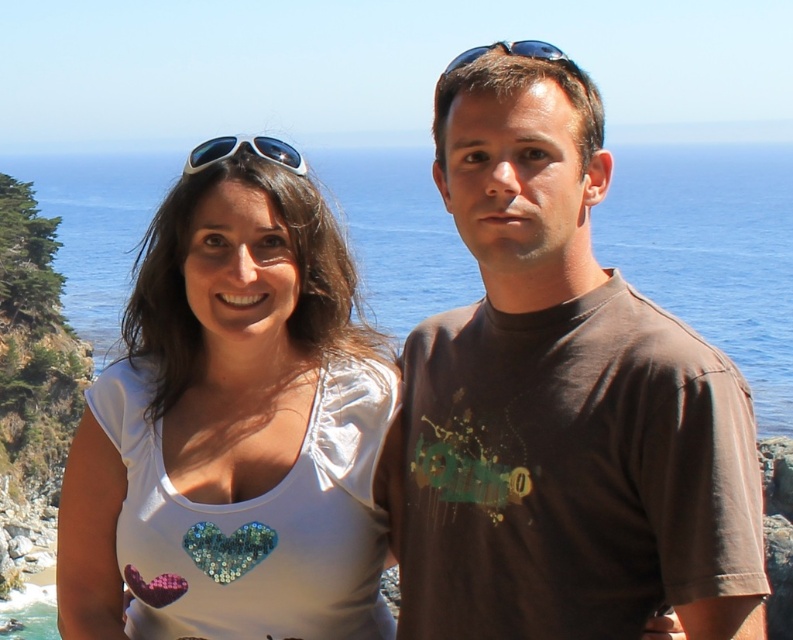
Question: Is blue water at center wider than white plastic goggles at upper center?

Choices:
 (A) no
 (B) yes

Answer: (B)

Question: Is brown cotton t-shirt at right smaller than white plastic goggles at upper center?

Choices:
 (A) no
 (B) yes

Answer: (B)

Question: Which point is farther to the camera?

Choices:
 (A) (234, 148)
 (B) (339, 248)
 (C) (690, 508)
 (D) (523, 48)

Answer: (B)

Question: Which point is closer to the camera?

Choices:
 (A) (144, 348)
 (B) (347, 188)

Answer: (A)

Question: Which point is closer to the camera taking this photo?

Choices:
 (A) (546, 316)
 (B) (131, 228)
 (C) (460, 61)

Answer: (A)

Question: Is the position of white sequined heart at center more distant than that of white plastic goggles at upper center?

Choices:
 (A) no
 (B) yes

Answer: (A)